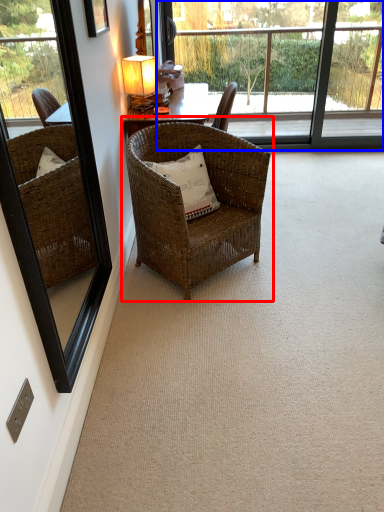
Question: Which object is further to the camera taking this photo, chair (highlighted by a red box) or bay window (highlighted by a blue box)?

Choices:
 (A) chair
 (B) bay window

Answer: (B)